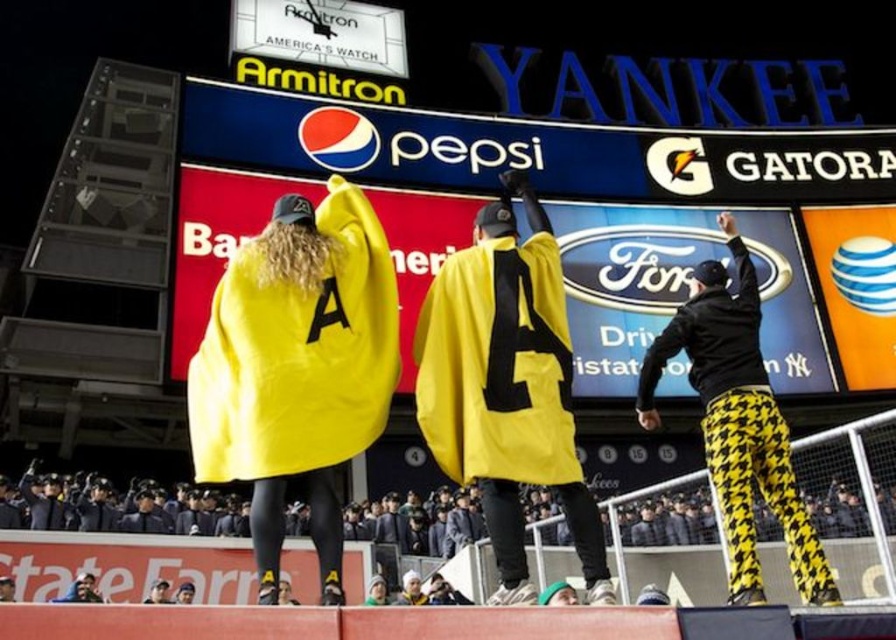
You are a photographer at the stadium and want to capture a clear shot of both the yellow fabric cape at center and the yellow matte cape at center. Since you can only focus on one at a time, which one should you focus on to ensure the other is still in the background?

The yellow fabric cape at center is above the yellow matte cape at center, so focusing on the yellow fabric cape at center will keep the yellow matte cape at center in the background.

You are a photographer standing at the edge of the field at Yankee Stadium. You notice two yellow capes at center. Which one is nearer to you, the yellow fabric cape at center or the yellow matte cape at center?

The yellow fabric cape at center is closer to the viewer than the yellow matte cape at center.

You are a photographer at the event and need to capture a closeup shot of the yellow matte cape at center. According to the coordinates provided, where should you aim your camera?

The yellow matte cape at center is located at coordinates point (506,387), so aim your camera there to capture the closeup shot.